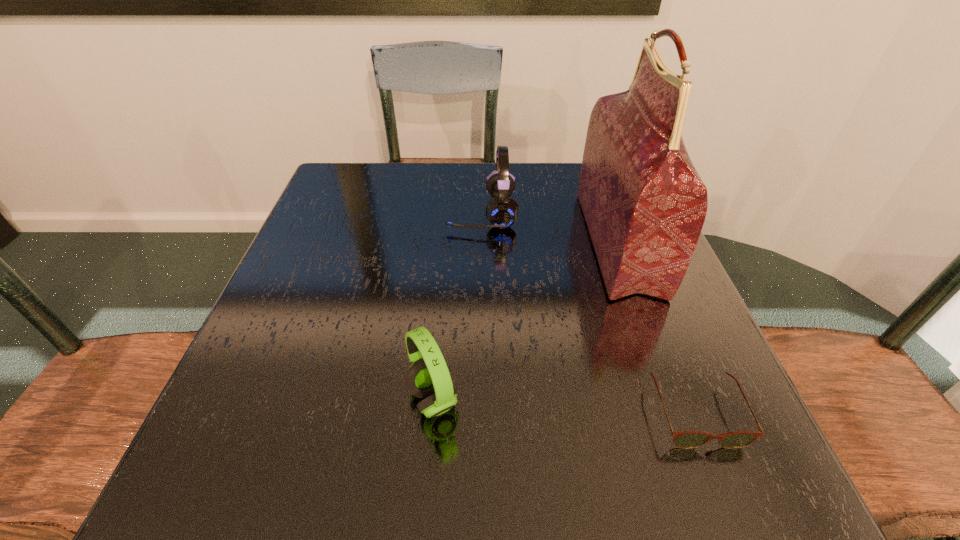
Find the location of a particular element. This screenshot has height=540, width=960. blank space located 0.390m on the back of the nearer headset is located at coordinates coord(448,227).

I want to click on free space located 0.060m at the front view of the shortest object, so click(727, 493).

Find the location of a particular element. The height and width of the screenshot is (540, 960). handbag situated at the far edge is located at coordinates (644, 203).

Locate an element on the screen. headset that is at the far edge is located at coordinates (502, 211).

The height and width of the screenshot is (540, 960). I want to click on object located in the near edge section of the desktop, so click(x=684, y=439).

The height and width of the screenshot is (540, 960). I want to click on handbag positioned at the right edge, so click(644, 203).

Identify the location of spectacles situated at the right edge. (684, 439).

Locate an element on the screen. The height and width of the screenshot is (540, 960). object present at the far right corner is located at coordinates (644, 203).

In order to click on object at the near right corner in this screenshot , I will do `click(684, 439)`.

The image size is (960, 540). In the image, there is a desktop. In order to click on free space at the far edge in this screenshot , I will do `click(437, 179)`.